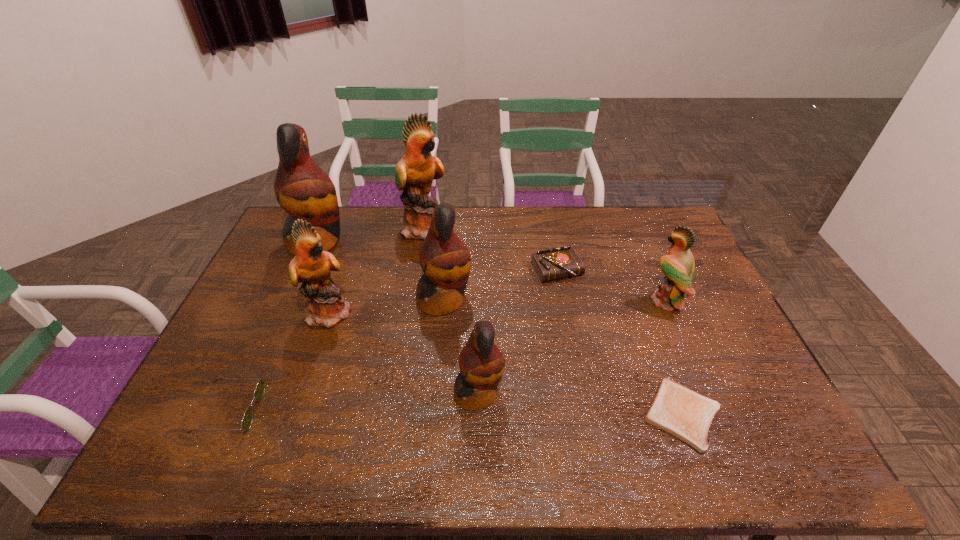
Where is `vacant area located on the face of the nearest parrot`? The height and width of the screenshot is (540, 960). vacant area located on the face of the nearest parrot is located at coordinates (578, 393).

I want to click on free spot located 0.160m on the front of the diary, so 567,325.

You are a GUI agent. You are given a task and a screenshot of the screen. Output one action in this format:
    pyautogui.click(x=<x>, y=<y>)
    Task: Click on the free point located on the front-facing side of the sunglasses
    The height and width of the screenshot is (540, 960).
    Given the screenshot: What is the action you would take?
    pyautogui.click(x=282, y=410)

In order to click on blank space located 0.390m on the back of the shortest object in this screenshot , I will do `click(632, 278)`.

In order to click on sunglasses present at the near edge in this screenshot , I will do `click(247, 419)`.

I want to click on toast located in the near edge section of the desktop, so click(x=676, y=409).

The width and height of the screenshot is (960, 540). I want to click on parrot positioned at the left edge, so click(x=302, y=189).

Find the location of a particular element. sunglasses positioned at the left edge is located at coordinates (247, 419).

The image size is (960, 540). What are the coordinates of `parrot at the right edge` in the screenshot? It's located at (678, 266).

I want to click on toast at the right edge, so click(676, 409).